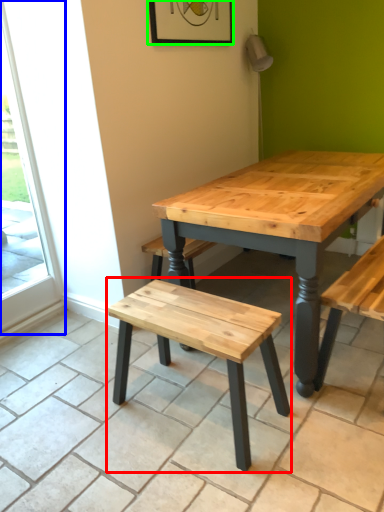
Question: Estimate the real-world distances between objects in this image. Which object is closer to stool (highlighted by a red box), screen door (highlighted by a blue box) or picture frame (highlighted by a green box)?

Choices:
 (A) screen door
 (B) picture frame

Answer: (A)